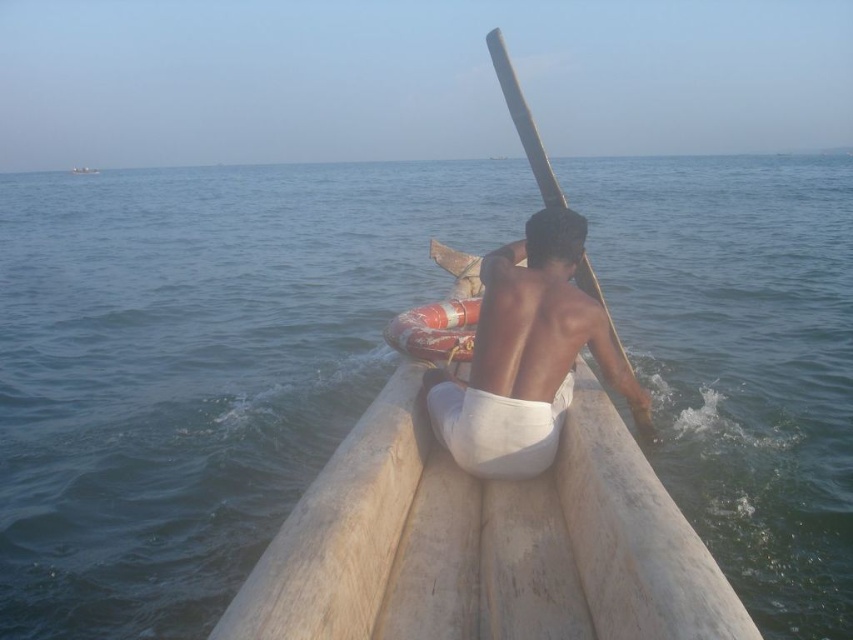
Where is `light brown wooden boat at center`? light brown wooden boat at center is located at coordinates (526, 355).

Is point (607, 378) positioned in front of point (86, 170)?

Yes, it is.

Does point (480, 358) come behind point (73, 170)?

No, (480, 358) is in front of (73, 170).

The width and height of the screenshot is (853, 640). In order to click on light brown wooden boat at center in this screenshot , I will do `click(526, 355)`.

Can you confirm if smooth wooden paddle at center is wider than wooden boat at upper center?

No.

Is point (654, 438) closer to camera compared to point (78, 172)?

Yes, point (654, 438) is closer to viewer.

Does point (639, 426) lie in front of point (94, 172)?

That is True.

You are a GUI agent. You are given a task and a screenshot of the screen. Output one action in this format:
    pyautogui.click(x=<x>, y=<y>)
    Task: Click on the smooth wooden paddle at center
    The width and height of the screenshot is (853, 640).
    Given the screenshot: What is the action you would take?
    pyautogui.click(x=523, y=120)

Is light brown wooden boat at center smaller than smooth wooden paddle at center?

Yes.

Locate an element on the screen. light brown wooden boat at center is located at coordinates (526, 355).

Locate an element on the screen. The width and height of the screenshot is (853, 640). light brown wooden boat at center is located at coordinates (526, 355).